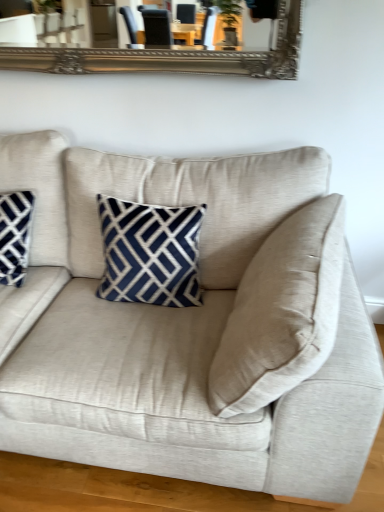
Describe the element at coordinates (39, 190) in the screenshot. I see `matte blue and white geometric pillow at left` at that location.

The width and height of the screenshot is (384, 512). I want to click on matte blue and white geometric pillow at left, so click(x=39, y=190).

Identify the location of beige fabric couch at center. Image resolution: width=384 pixels, height=512 pixels. (185, 326).

The height and width of the screenshot is (512, 384). Describe the element at coordinates (185, 326) in the screenshot. I see `beige fabric couch at center` at that location.

You are a GUI agent. You are given a task and a screenshot of the screen. Output one action in this format:
    pyautogui.click(x=<x>, y=<y>)
    Task: Click on the matte blue and white geometric pillow at left
    
    Given the screenshot: What is the action you would take?
    pyautogui.click(x=39, y=190)

Considering the relative positions of beige fabric couch at center and matte blue and white geometric pillow at left in the image provided, is beige fabric couch at center to the left or to the right of matte blue and white geometric pillow at left?

From the image, it's evident that beige fabric couch at center is to the right of matte blue and white geometric pillow at left.

Does beige fabric couch at center lie behind matte blue and white geometric pillow at left?

No.

Which is in front, point (304, 480) or point (41, 239)?

The point (304, 480) is closer to the camera.

From the image's perspective, which object appears higher, beige fabric couch at center or matte blue and white geometric pillow at left?

From the image's view, matte blue and white geometric pillow at left is above.

From a real-world perspective, who is located higher, beige fabric couch at center or matte blue and white geometric pillow at left?

matte blue and white geometric pillow at left, from a real-world perspective.

Looking at their sizes, would you say beige fabric couch at center is wider or thinner than matte blue and white geometric pillow at left?

Considering their sizes, beige fabric couch at center looks broader than matte blue and white geometric pillow at left.

Does beige fabric couch at center have a greater height compared to matte blue and white geometric pillow at left?

A: Yes.

Who is smaller, beige fabric couch at center or matte blue and white geometric pillow at left?

matte blue and white geometric pillow at left.

Is beige fabric couch at center not within matte blue and white geometric pillow at left?

Absolutely, beige fabric couch at center is external to matte blue and white geometric pillow at left.

Is beige fabric couch at center far away from matte blue and white geometric pillow at left?

beige fabric couch at center is actually quite close to matte blue and white geometric pillow at left.

Is beige fabric couch at center positioned with its back to matte blue and white geometric pillow at left?

Yes, matte blue and white geometric pillow at left is at the back of beige fabric couch at center.

How different are the orientations of beige fabric couch at center and matte blue and white geometric pillow at left in degrees?

There is a 0.614-degree angle between the facing directions of beige fabric couch at center and matte blue and white geometric pillow at left.

How much distance is there between beige fabric couch at center and matte blue and white geometric pillow at left?

beige fabric couch at center is 18.88 inches away from matte blue and white geometric pillow at left.

You are a GUI agent. You are given a task and a screenshot of the screen. Output one action in this format:
    pyautogui.click(x=<x>, y=<y>)
    Task: Click on the pillow behind the beige fabric couch at center
    The width and height of the screenshot is (384, 512).
    Given the screenshot: What is the action you would take?
    pyautogui.click(x=39, y=190)

Considering the positions of objects matte blue and white geometric pillow at left and beige fabric couch at center in the image provided, who is more to the left, matte blue and white geometric pillow at left or beige fabric couch at center?

Positioned to the left is matte blue and white geometric pillow at left.

In the scene shown: Does matte blue and white geometric pillow at left lie behind beige fabric couch at center?

Yes, it is.

Which is farther, (7, 155) or (368, 423)?

The point (7, 155) is behind.

From the image's perspective, relative to beige fabric couch at center, is matte blue and white geometric pillow at left above or below?

Based on their image positions, matte blue and white geometric pillow at left is located above beige fabric couch at center.

From a real-world perspective, which is physically above, matte blue and white geometric pillow at left or beige fabric couch at center?

matte blue and white geometric pillow at left is physically above.

Does matte blue and white geometric pillow at left have a lesser width compared to beige fabric couch at center?

Yes, matte blue and white geometric pillow at left is thinner than beige fabric couch at center.

Does matte blue and white geometric pillow at left have a lesser height compared to beige fabric couch at center?

A: Indeed, matte blue and white geometric pillow at left has a lesser height compared to beige fabric couch at center.

Between matte blue and white geometric pillow at left and beige fabric couch at center, which one has larger size?

beige fabric couch at center is bigger.

Is matte blue and white geometric pillow at left situated inside beige fabric couch at center or outside?

matte blue and white geometric pillow at left is enclosed within beige fabric couch at center.

Would you consider matte blue and white geometric pillow at left to be distant from beige fabric couch at center?

matte blue and white geometric pillow at left is near beige fabric couch at center, not far away.

Is matte blue and white geometric pillow at left oriented towards beige fabric couch at center?

Yes, matte blue and white geometric pillow at left is facing beige fabric couch at center.

What's the angular difference between matte blue and white geometric pillow at left and beige fabric couch at center's facing directions?

There is a 0.614-degree angle between the facing directions of matte blue and white geometric pillow at left and beige fabric couch at center.

Locate an element on the screen. This screenshot has height=512, width=384. pillow on the left side of beige fabric couch at center is located at coordinates (39, 190).

The height and width of the screenshot is (512, 384). Find the location of `pillow above the beige fabric couch at center (from the image's perspective)`. pillow above the beige fabric couch at center (from the image's perspective) is located at coordinates (39, 190).

The width and height of the screenshot is (384, 512). Identify the location of pillow located above the beige fabric couch at center (from a real-world perspective). (39, 190).